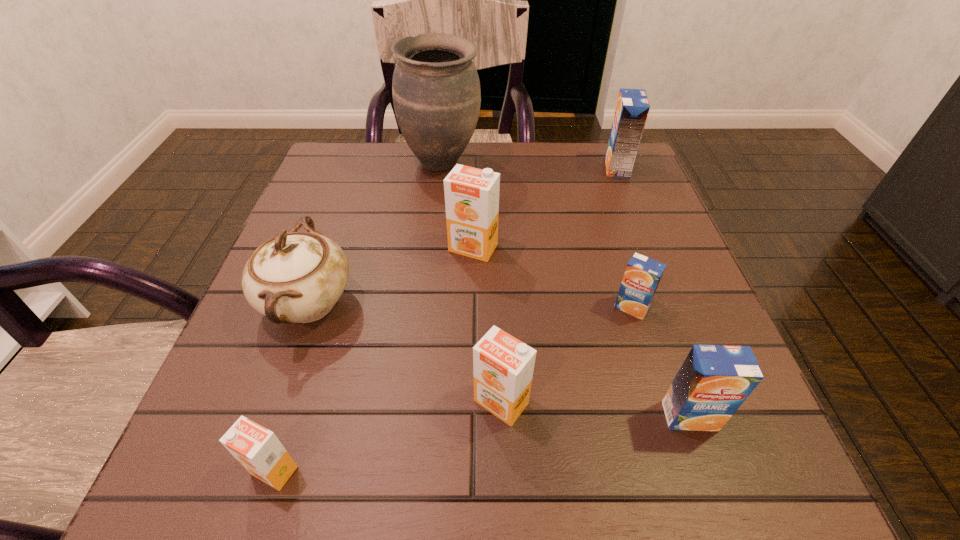
Where is `urn`? urn is located at coordinates (436, 93).

The width and height of the screenshot is (960, 540). Find the location of `the farthest orange juice`. the farthest orange juice is located at coordinates (632, 108).

What are the coordinates of `the biggest blue orange_juice` in the screenshot? It's located at (632, 108).

You are a GUI agent. You are given a task and a screenshot of the screen. Output one action in this format:
    pyautogui.click(x=<x>, y=<y>)
    Task: Click on the fifth nearest orange juice
    This screenshot has height=540, width=960.
    Given the screenshot: What is the action you would take?
    pyautogui.click(x=471, y=195)

At what (x,y) coordinates should I click in order to perform the action: click on the farthest orange orange juice. Please return your answer as a coordinate pair (x, y). This screenshot has height=540, width=960. Looking at the image, I should click on (471, 195).

This screenshot has height=540, width=960. Find the location of `chinaware`. chinaware is located at coordinates (295, 277).

You are a GUI agent. You are given a task and a screenshot of the screen. Output one action in this format:
    pyautogui.click(x=<x>, y=<y>)
    Task: Click on the second smallest blue orange_juice
    
    Given the screenshot: What is the action you would take?
    pyautogui.click(x=714, y=380)

Locate an element on the screen. The height and width of the screenshot is (540, 960). the second nearest orange orange juice is located at coordinates (x=503, y=366).

Locate an element on the screen. The image size is (960, 540). the second farthest blue orange_juice is located at coordinates (642, 275).

Find the location of a particular element. the smallest blue orange_juice is located at coordinates (642, 275).